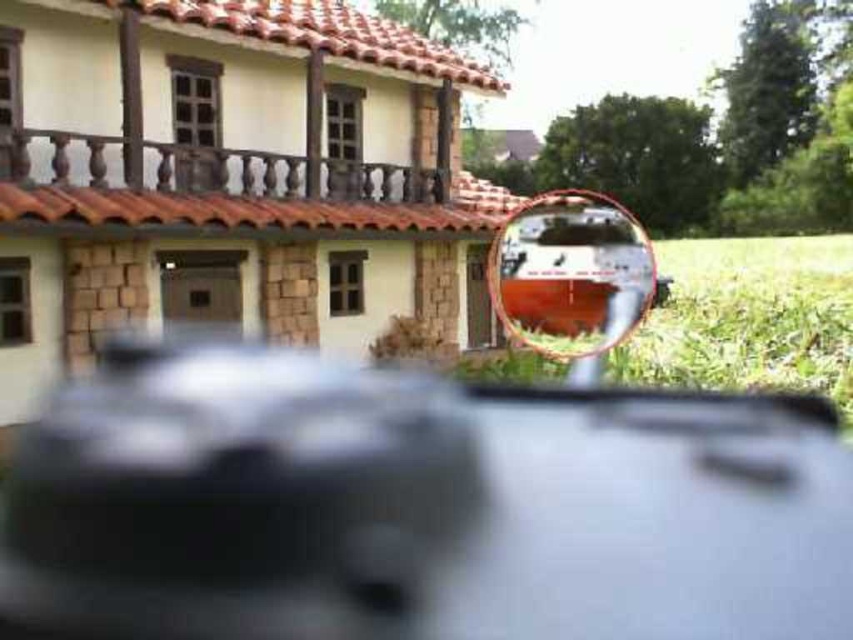
You are a delivery driver who needs to park your metallic silver car at center near the green grass at lower right. Given that the parking space between them is 36.99 feet, is this distance sufficient for your vehicle which is 15 feet long?

The metallic silver car at center is 36.99 feet away from the green grass at lower right. Since the car is only 15 feet long, the distance between them is more than enough for parking.

You are a delivery driver who needs to park your metallic silver car at center in a spot that requires you to align it with the clear glass rearview mirror at center. According to the reflection in the mirror, which side of the mirror should the car be parked on?

The metallic silver car at center is positioned on the left side of the clear glass rearview mirror at center, so according to the reflection in the mirror, the car should be parked on the left side of the mirror.